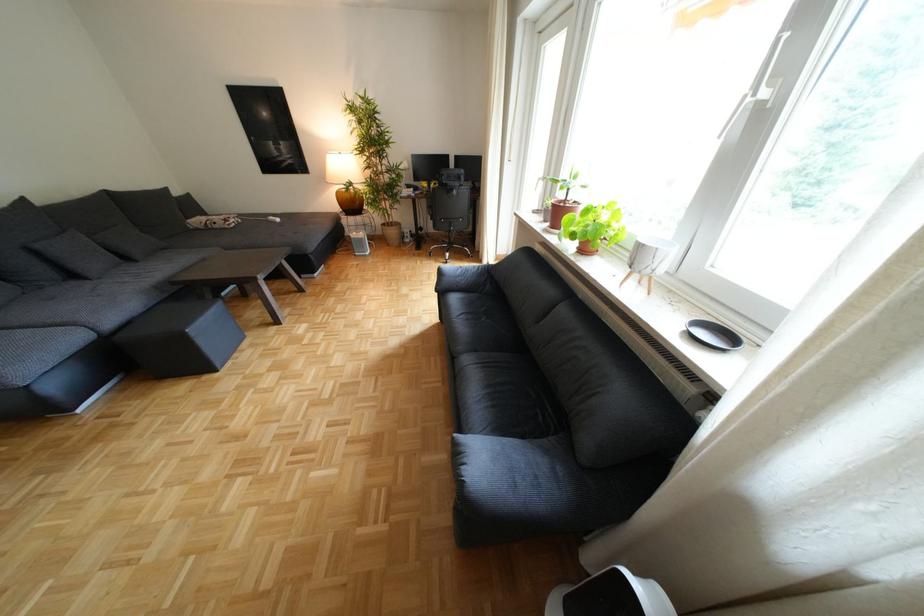
Describe the element at coordinates (79, 254) in the screenshot. I see `the grey sofa sitting surface` at that location.